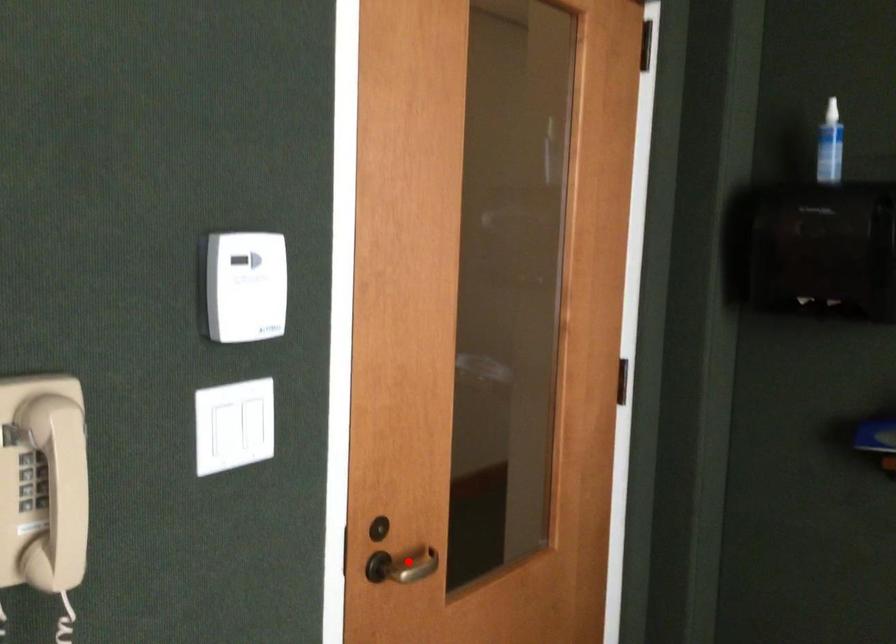
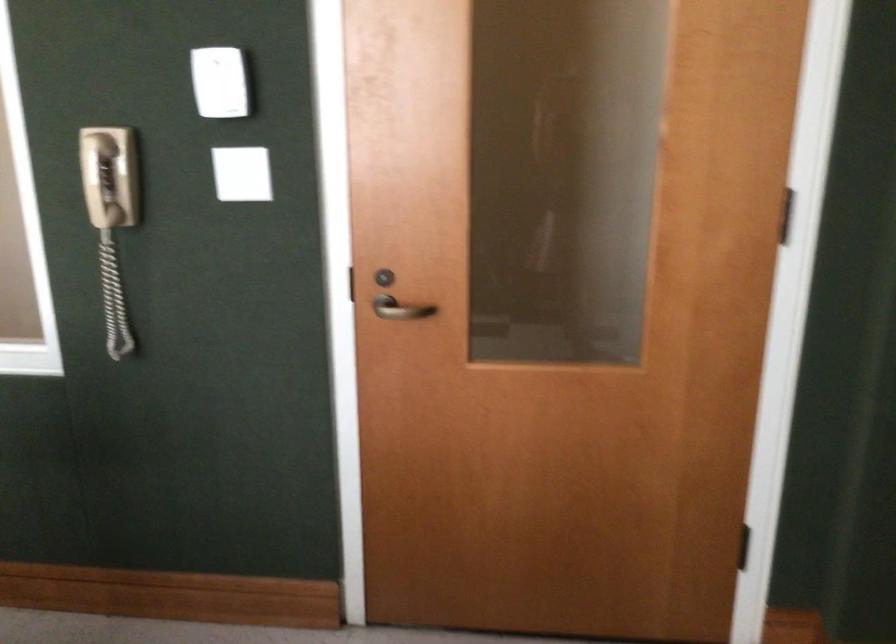
Question: A red point is marked in image1. In image2, is the corresponding 3D point closer to the camera or farther? Reply with the corresponding letter.

Choices:
 (A) The corresponding 3D point is closer.
 (B) The corresponding 3D point is farther.

Answer: (B)